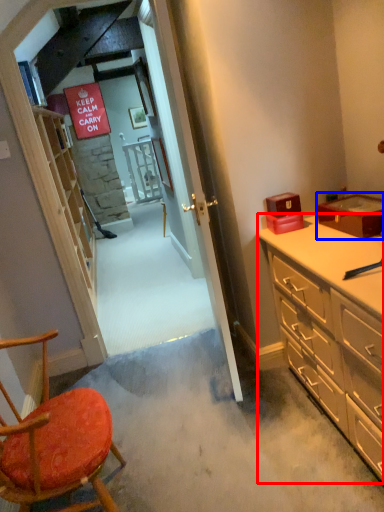
Question: Which object is closer to the camera taking this photo, cabinetry (highlighted by a red box) or box (highlighted by a blue box)?

Choices:
 (A) cabinetry
 (B) box

Answer: (A)